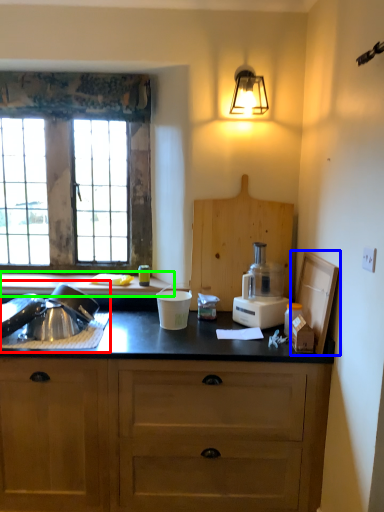
Question: Which is farther away from sink (highlighted by a red box)? cardboard box (highlighted by a blue box) or countertop (highlighted by a green box)?

Choices:
 (A) cardboard box
 (B) countertop

Answer: (A)